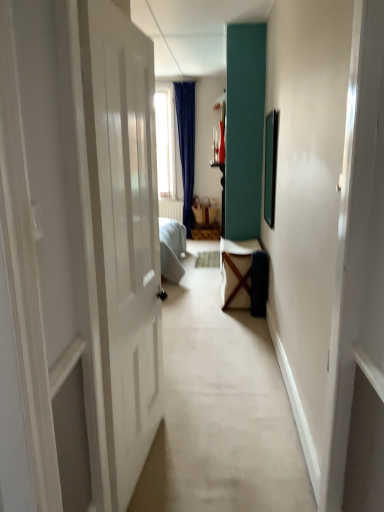
Question: Should I look upward or downward to see brown woven basket at center, the second furniture from the bottom?

Choices:
 (A) up
 (B) down

Answer: (A)

Question: Could you tell me if wooden chair at center, marked as the 1th furniture in a front-to-back arrangement, is facing brown woven basket at center, which is the first furniture in top-to-bottom order?

Choices:
 (A) yes
 (B) no

Answer: (B)

Question: Is wooden chair at center, which is the second furniture from back to front, thinner than brown woven basket at center, which appears as the second furniture when viewed from the front?

Choices:
 (A) no
 (B) yes

Answer: (A)

Question: From a real-world perspective, does wooden chair at center, which is the second furniture from back to front, sit lower than brown woven basket at center, acting as the first furniture starting from the back?

Choices:
 (A) no
 (B) yes

Answer: (B)

Question: From the image's perspective, is wooden chair at center, which is the second furniture from back to front, above brown woven basket at center, the second furniture from the bottom?

Choices:
 (A) yes
 (B) no

Answer: (B)

Question: Can you confirm if wooden chair at center, which is the second furniture from back to front, is taller than brown woven basket at center, acting as the first furniture starting from the back?

Choices:
 (A) yes
 (B) no

Answer: (A)

Question: Can brown woven basket at center, acting as the first furniture starting from the back, be found inside wooden chair at center, which is the second furniture from back to front?

Choices:
 (A) yes
 (B) no

Answer: (B)

Question: From a real-world perspective, does brown woven basket at center, the second furniture from the bottom, stand above wooden chair at center, which is the second furniture from back to front?

Choices:
 (A) no
 (B) yes

Answer: (B)

Question: From the image's perspective, is brown woven basket at center, the second furniture from the bottom, beneath wooden chair at center, the 2th furniture in the top-to-bottom sequence?

Choices:
 (A) no
 (B) yes

Answer: (A)

Question: From a real-world perspective, is brown woven basket at center, which appears as the second furniture when viewed from the front, physically below wooden chair at center, the 2th furniture in the top-to-bottom sequence?

Choices:
 (A) no
 (B) yes

Answer: (A)

Question: Does brown woven basket at center, acting as the first furniture starting from the back, have a smaller size compared to wooden chair at center, which is the second furniture from back to front?

Choices:
 (A) yes
 (B) no

Answer: (A)

Question: Considering the relative sizes of brown woven basket at center, which appears as the second furniture when viewed from the front, and wooden chair at center, marked as the 1th furniture in a front-to-back arrangement, in the image provided, is brown woven basket at center, which appears as the second furniture when viewed from the front, taller than wooden chair at center, marked as the 1th furniture in a front-to-back arrangement,?

Choices:
 (A) no
 (B) yes

Answer: (A)

Question: Is brown woven basket at center, which is the first furniture in top-to-bottom order, outside wooden chair at center, marked as the 1th furniture in a front-to-back arrangement?

Choices:
 (A) no
 (B) yes

Answer: (B)

Question: In terms of height, does brown woven basket at center, the second furniture from the bottom, look taller or shorter compared to wooden chair at center, which is the second furniture from back to front?

Choices:
 (A) tall
 (B) short

Answer: (B)